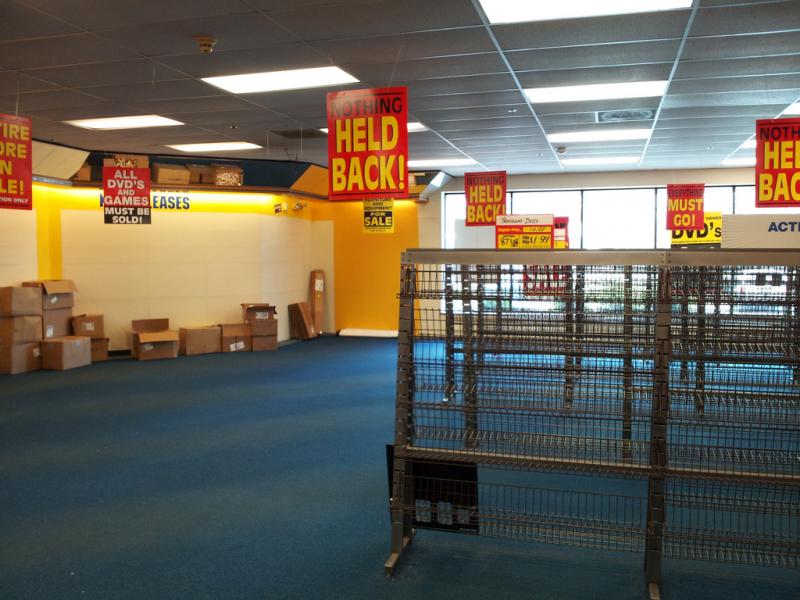
Identify the location of blue floor. Image resolution: width=800 pixels, height=600 pixels. (269, 447).